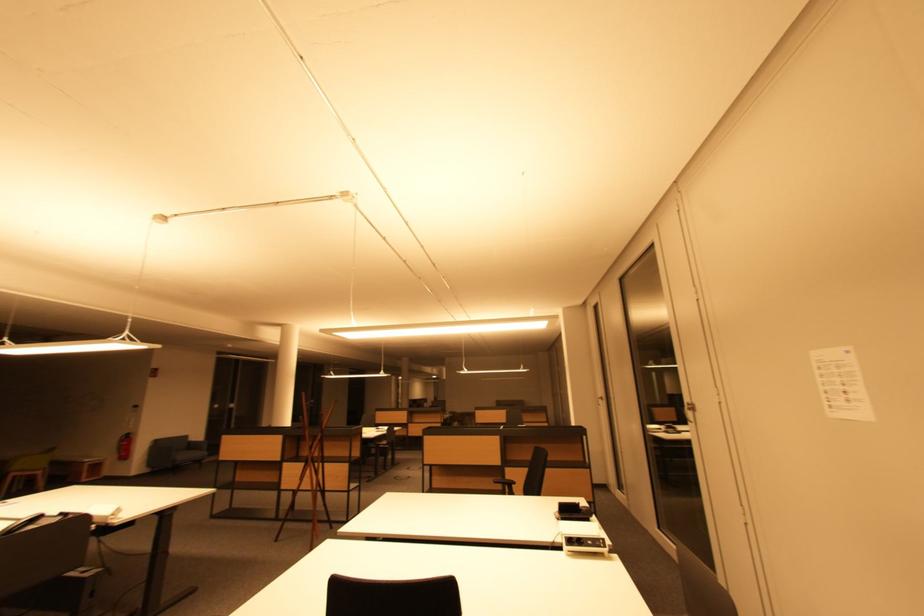
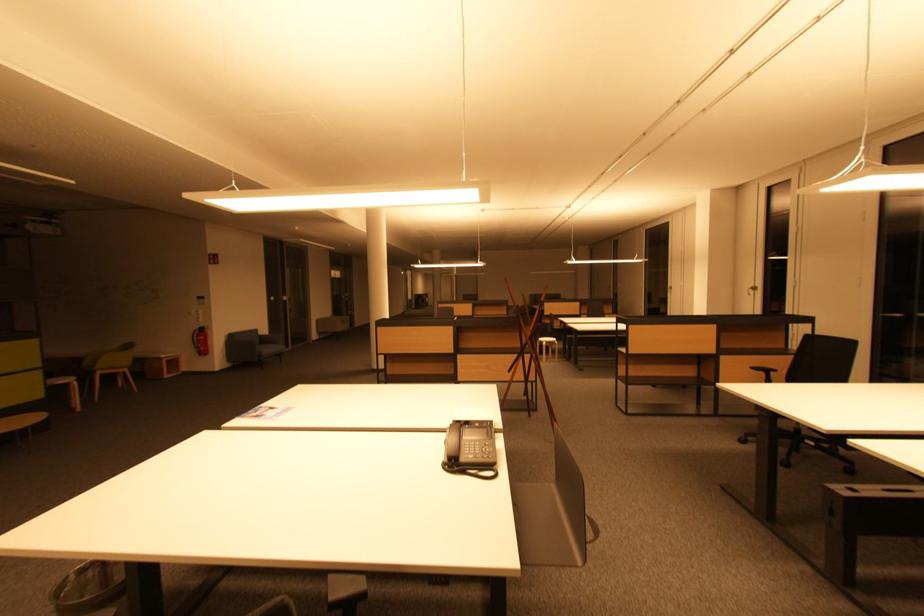
In the second image, find the point that corresponds to point (188, 458) in the first image.

(272, 352)